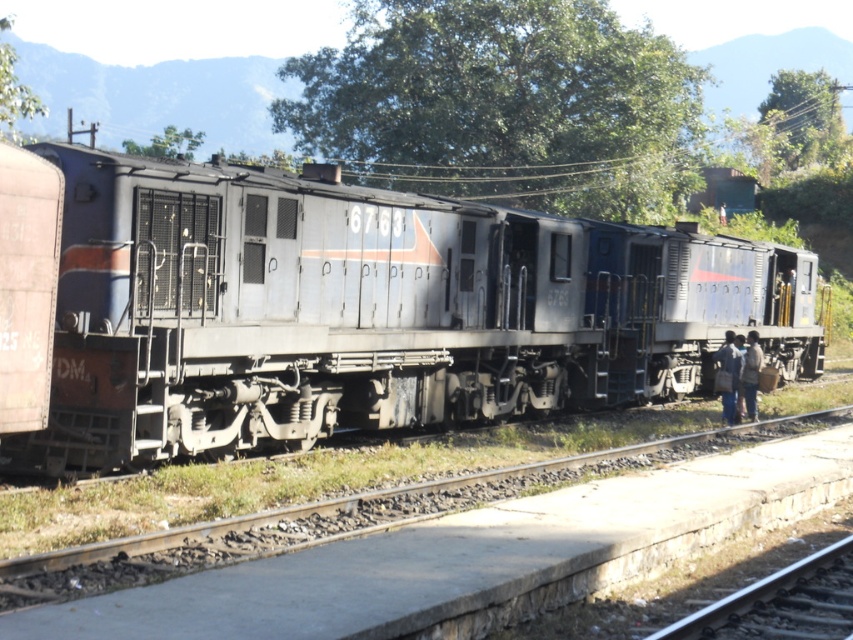
Does matte gray train at center appear on the left side of dark blue fabric at lower right?

Correct, you'll find matte gray train at center to the left of dark blue fabric at lower right.

Measure the distance between matte gray train at center and dark blue fabric at lower right.

The distance of matte gray train at center from dark blue fabric at lower right is 6.65 meters.

Locate an element on the screen. The image size is (853, 640). matte gray train at center is located at coordinates (367, 310).

In the scene shown: Is matte gray train at center below metal at right?

No.

Is point (270, 205) positioned before point (781, 637)?

No, it is behind (781, 637).

Find the location of a particular element. The image size is (853, 640). matte gray train at center is located at coordinates (367, 310).

Can you confirm if metal at right is bigger than dark blue fabric at lower right?

Yes, metal at right is bigger than dark blue fabric at lower right.

Can you confirm if metal at right is taller than dark blue fabric at lower right?

In fact, metal at right may be shorter than dark blue fabric at lower right.

The width and height of the screenshot is (853, 640). What do you see at coordinates (781, 604) in the screenshot? I see `metal at right` at bounding box center [781, 604].

At what (x,y) coordinates should I click in order to perform the action: click on metal at right. Please return your answer as a coordinate pair (x, y). The image size is (853, 640). Looking at the image, I should click on (781, 604).